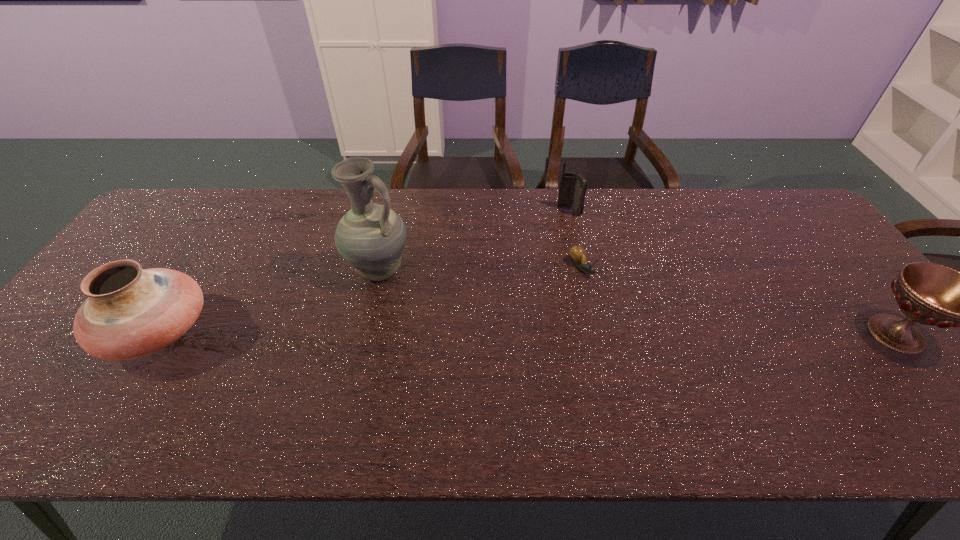
At what (x,y) coordinates should I click in order to perform the action: click on the leftmost object. Please return your answer as a coordinate pair (x, y). This screenshot has width=960, height=540. Looking at the image, I should click on [130, 312].

Image resolution: width=960 pixels, height=540 pixels. In order to click on chalice in this screenshot , I will do click(931, 294).

Locate an element on the screen. Image resolution: width=960 pixels, height=540 pixels. escargot is located at coordinates (579, 257).

The width and height of the screenshot is (960, 540). Identify the location of cellular telephone. (573, 187).

Where is `the tallest object`? Image resolution: width=960 pixels, height=540 pixels. the tallest object is located at coordinates (371, 237).

Where is `pitcher`? Image resolution: width=960 pixels, height=540 pixels. pitcher is located at coordinates (371, 237).

Locate an element on the screen. This screenshot has height=540, width=960. free space located 0.210m on the back of the pottery is located at coordinates (215, 241).

This screenshot has width=960, height=540. I want to click on free space located on the back of the rightmost object, so 830,253.

Locate an element on the screen. This screenshot has height=540, width=960. vacant region located 0.260m on the front-facing side of the shortest object is located at coordinates (650, 353).

In order to click on free space located 0.080m on the front-facing side of the shortest object in this screenshot , I will do `click(606, 301)`.